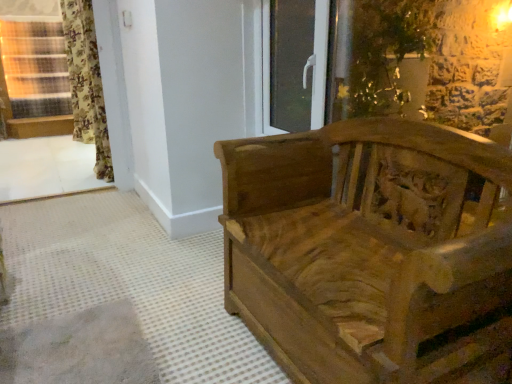
Identify the location of free point behind wooden window frame at lower left. (56, 203).